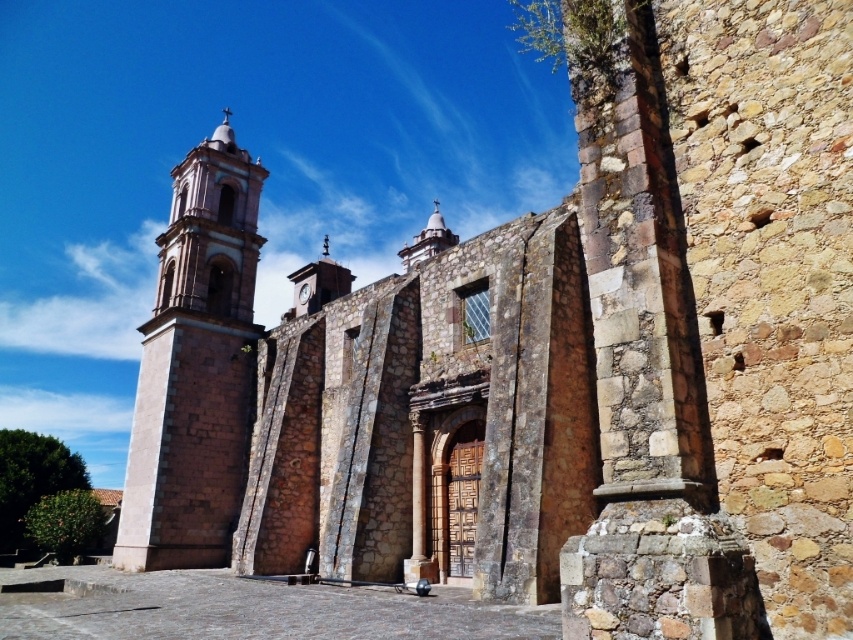
You are standing in front of the historic church and want to take a photo of both the smooth stone tower at left and the metallic clock face at center. Since you have a wide angle lens, you want to ensure both objects are in frame. Based on their positions, which object should you focus on to ensure both are in focus?

You should focus on the smooth stone tower at left because it is closer to you than the metallic clock face at center, and with a wide angle lens, focusing on the closer object will keep both in focus.

You are standing in front of a historic church and notice the smooth stone tower at left. If you want to take a photo that includes both the tower and the main church structure without moving your position, will the tower fit entirely in the frame if your camera has a 60 degree field of view?

The smooth stone tower at left is 69.42 meters from viewer. Since the camera has a 60 degree field of view, the tower will likely fit within the frame as the distance is sufficient for the angle to encompass both the tower and the main church structure.

You are a painter wanting to capture the church in a painting. You notice the smooth stone tower at left and the metallic clock face at center. Which object should you focus on if you want to paint the wider feature?

The smooth stone tower at left is wider than the metallic clock face at center, so you should focus on the smooth stone tower at left to paint the wider feature.